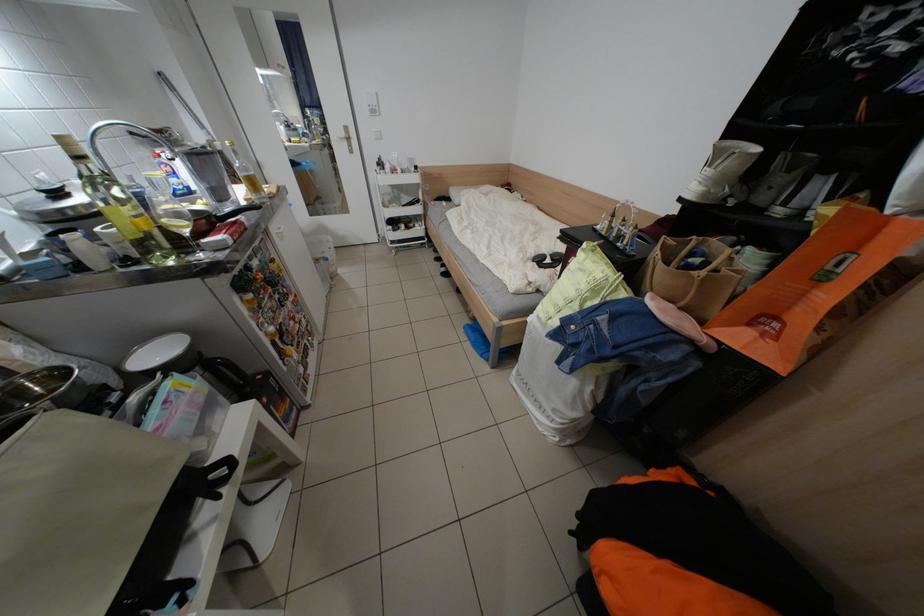
Locate an element on the screen. The height and width of the screenshot is (616, 924). silver door handle is located at coordinates (347, 137).